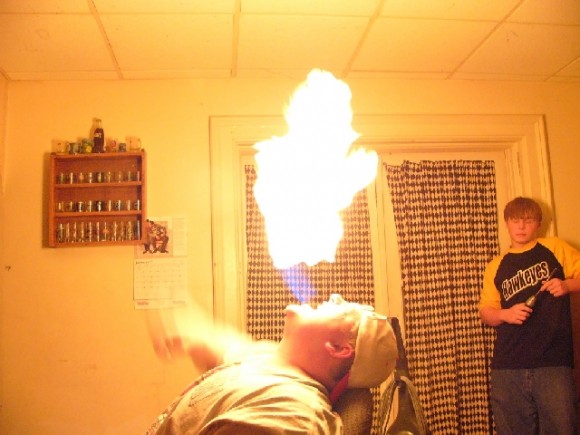
Image resolution: width=580 pixels, height=435 pixels. Find the location of `doorframe`. doorframe is located at coordinates (539, 147).